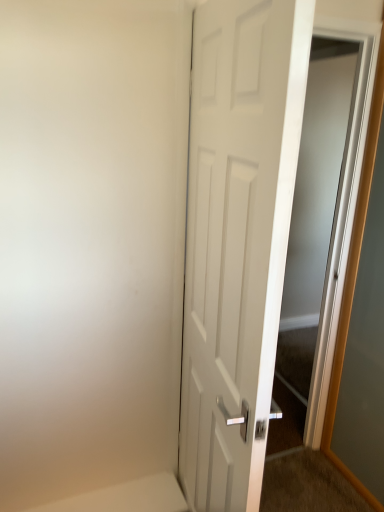
Measure the distance between white matte door at center and camera.

white matte door at center is 27.84 inches from camera.

The image size is (384, 512). What do you see at coordinates (237, 237) in the screenshot?
I see `white matte door at center` at bounding box center [237, 237].

Identify the location of white matte door at center. The height and width of the screenshot is (512, 384). coord(237,237).

Find the location of a particular element. white glossy elevator at right is located at coordinates (323, 219).

Describe the element at coordinates (323, 219) in the screenshot. Image resolution: width=384 pixels, height=512 pixels. I see `white glossy elevator at right` at that location.

The image size is (384, 512). What are the coordinates of `white matte door at center` in the screenshot? It's located at (237, 237).

Consider the image. Between white matte door at center and white glossy elevator at right, which one appears on the right side from the viewer's perspective?

white glossy elevator at right.

Which object is further away from the camera, white matte door at center or white glossy elevator at right?

white glossy elevator at right is more distant.

Is point (284, 170) in front of point (373, 48)?

Yes, it is.

From the image's perspective, is white matte door at center positioned above or below white glossy elevator at right?

white matte door at center is below white glossy elevator at right.

From a real-world perspective, is white matte door at center below white glossy elevator at right?

Yes, from a real-world perspective, white matte door at center is under white glossy elevator at right.

In terms of width, does white matte door at center look wider or thinner when compared to white glossy elevator at right?

Clearly, white matte door at center has more width compared to white glossy elevator at right.

In terms of height, does white matte door at center look taller or shorter compared to white glossy elevator at right?

In the image, white matte door at center appears to be shorter than white glossy elevator at right.

Does white matte door at center have a smaller size compared to white glossy elevator at right?

No.

Is white matte door at center spatially inside white glossy elevator at right, or outside of it?

white matte door at center is not enclosed by white glossy elevator at right.

Would you say white matte door at center is a long distance from white glossy elevator at right?

Yes, white matte door at center is far from white glossy elevator at right.

Is white matte door at center oriented away from white glossy elevator at right?

No, white matte door at center is not facing away from white glossy elevator at right.

What's the angular difference between white matte door at center and white glossy elevator at right's facing directions?

171 degrees separate the facing orientations of white matte door at center and white glossy elevator at right.

Locate an element on the screen. This screenshot has width=384, height=512. door that is on the left side of white glossy elevator at right is located at coordinates (237, 237).

Which is more to the left, white glossy elevator at right or white matte door at center?

white matte door at center.

Is white glossy elevator at right closer to camera compared to white matte door at center?

No, it is behind white matte door at center.

Which is in front, point (366, 77) or point (265, 447)?

The point (265, 447) is closer to the camera.

From the image's perspective, would you say white glossy elevator at right is shown under white matte door at center?

Incorrect, from the image's perspective, white glossy elevator at right is higher than white matte door at center.

From a real-world perspective, is white glossy elevator at right located beneath white matte door at center?

No.

Looking at their sizes, would you say white glossy elevator at right is wider or thinner than white matte door at center?

Clearly, white glossy elevator at right has less width compared to white matte door at center.

Considering the relative sizes of white glossy elevator at right and white matte door at center in the image provided, is white glossy elevator at right shorter than white matte door at center?

No.

Who is bigger, white glossy elevator at right or white matte door at center?

With larger size is white matte door at center.

Is white glossy elevator at right not inside white matte door at center?

white glossy elevator at right lies outside white matte door at center's area.

Is the surface of white glossy elevator at right in direct contact with white matte door at center?

white glossy elevator at right is not next to white matte door at center, and they're not touching.

Is white matte door at center at the back of white glossy elevator at right?

white glossy elevator at right is not turned away from white matte door at center.

How much distance is there between white glossy elevator at right and white matte door at center?

white glossy elevator at right and white matte door at center are 3.54 feet apart from each other.

This screenshot has height=512, width=384. I want to click on elevator that is above the white matte door at center (from a real-world perspective), so click(323, 219).

Identify the location of door in front of the white glossy elevator at right. The height and width of the screenshot is (512, 384). (237, 237).

The width and height of the screenshot is (384, 512). What are the coordinates of `door that appears on the left of white glossy elevator at right` in the screenshot? It's located at (237, 237).